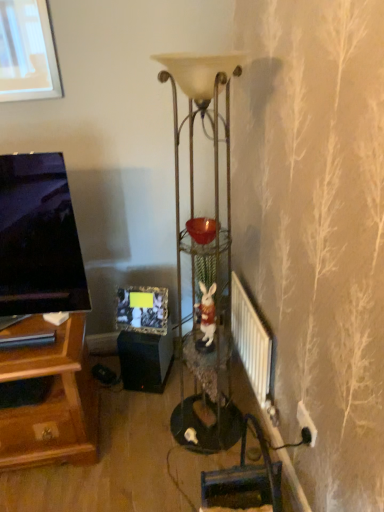
Question: Can you confirm if white ceramic rabbit at center is taller than metallic gold floor lamp at center?

Choices:
 (A) yes
 (B) no

Answer: (B)

Question: From the image's perspective, is white ceramic rabbit at center beneath metallic gold floor lamp at center?

Choices:
 (A) yes
 (B) no

Answer: (A)

Question: Is white ceramic rabbit at center surrounding metallic gold floor lamp at center?

Choices:
 (A) no
 (B) yes

Answer: (A)

Question: Can you confirm if white ceramic rabbit at center is smaller than metallic gold floor lamp at center?

Choices:
 (A) no
 (B) yes

Answer: (B)

Question: Considering the relative sizes of white ceramic rabbit at center and metallic gold floor lamp at center in the image provided, is white ceramic rabbit at center bigger than metallic gold floor lamp at center?

Choices:
 (A) no
 (B) yes

Answer: (A)

Question: Relative to metallic gold floor lamp at center, is white metallic radiator at lower right in front or behind?

Choices:
 (A) behind
 (B) front

Answer: (A)

Question: Considering the positions of white metallic radiator at lower right and metallic gold floor lamp at center in the image, is white metallic radiator at lower right bigger or smaller than metallic gold floor lamp at center?

Choices:
 (A) small
 (B) big

Answer: (A)

Question: Does point (241, 311) appear closer or farther from the camera than point (213, 137)?

Choices:
 (A) farther
 (B) closer

Answer: (A)

Question: Is white metallic radiator at lower right taller or shorter than metallic gold floor lamp at center?

Choices:
 (A) tall
 (B) short

Answer: (B)

Question: Is black matte speaker at lower center in front of or behind matte black picture frame at center in the image?

Choices:
 (A) front
 (B) behind

Answer: (B)

Question: Based on their positions, is black matte speaker at lower center located to the left or right of matte black picture frame at center?

Choices:
 (A) left
 (B) right

Answer: (B)

Question: Does point (134, 345) appear closer or farther from the camera than point (150, 310)?

Choices:
 (A) farther
 (B) closer

Answer: (A)

Question: Choose the correct answer: Is black matte speaker at lower center inside matte black picture frame at center or outside it?

Choices:
 (A) inside
 (B) outside

Answer: (B)

Question: Looking at their shapes, would you say white metallic radiator at lower right is wider or thinner than matte black picture frame at center?

Choices:
 (A) wide
 (B) thin

Answer: (B)

Question: From the image's perspective, is white metallic radiator at lower right above or below matte black picture frame at center?

Choices:
 (A) above
 (B) below

Answer: (B)